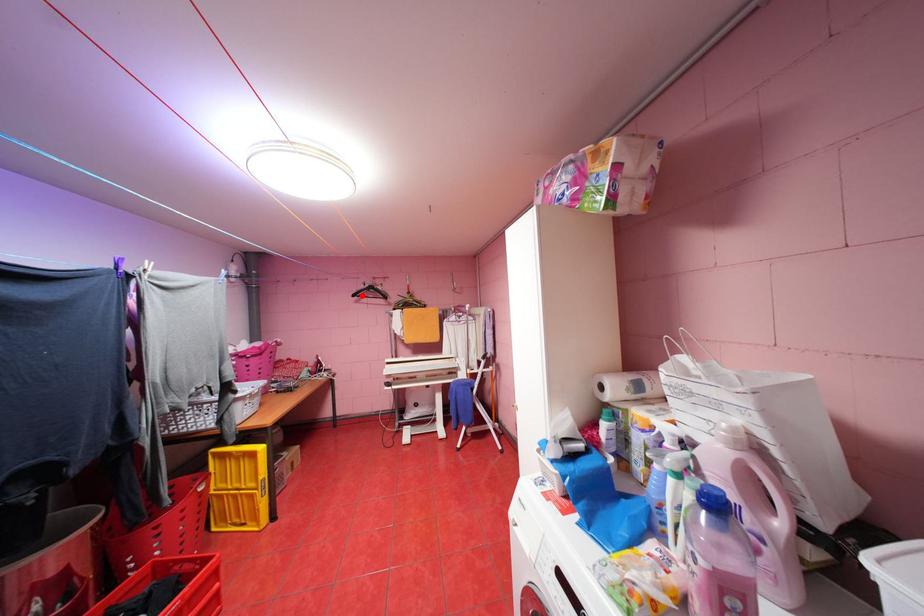
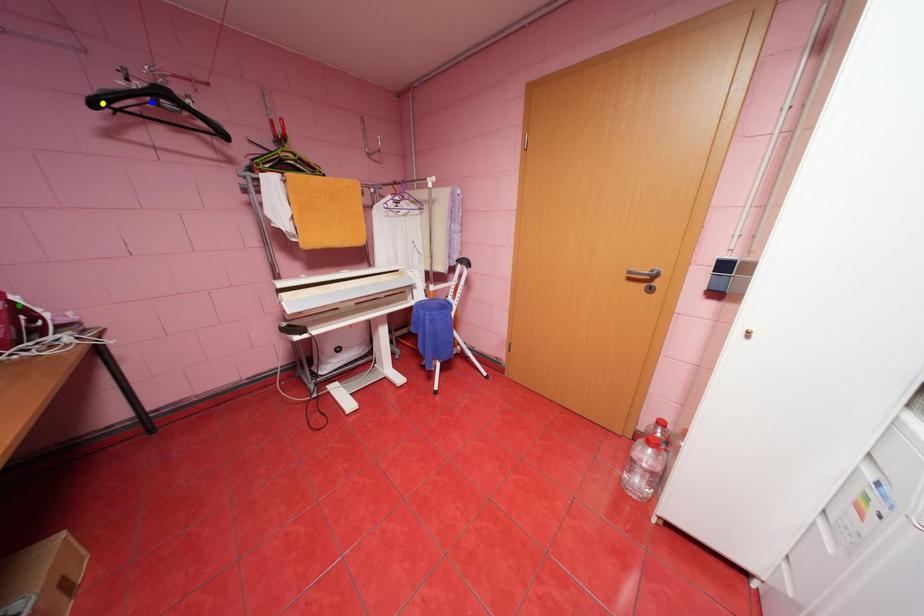
Question: I am providing you with two images of the same scene from different viewpoints. A red point is marked on the first image. You are given multiple points on the second image. Which point in image 2 represents the same 3d spot as the red point in image 1?

Choices:
 (A) green point
 (B) blue point
 (C) yellow point

Answer: (C)